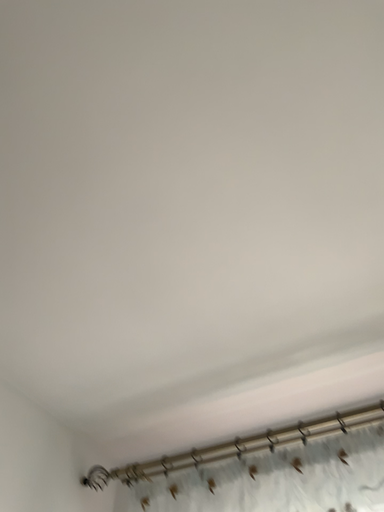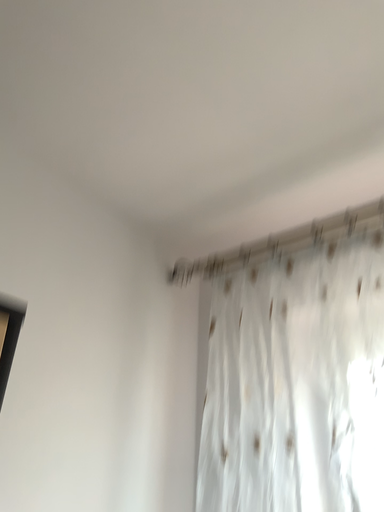
Question: How did the camera likely rotate when shooting the video?

Choices:
 (A) rotated left
 (B) rotated right

Answer: (A)